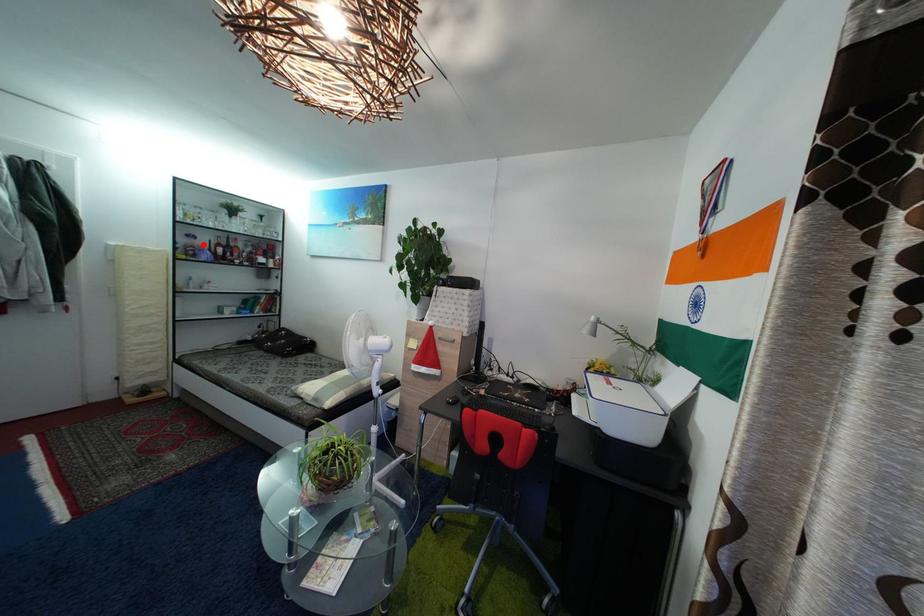
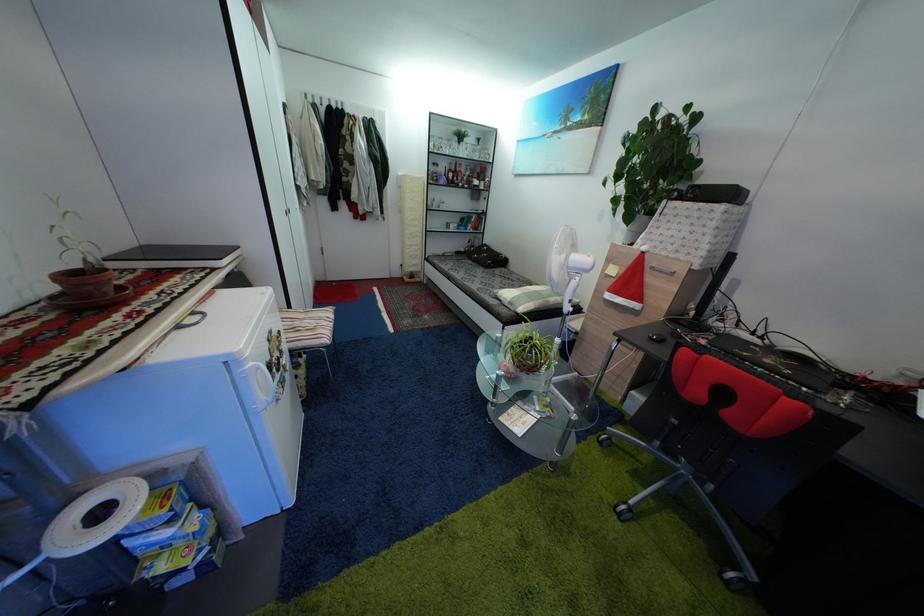
Question: I am providing you with two images of the same scene from different viewpoints. A red point is shown in image1. For the corresponding object point in image2, is it positioned nearer or farther from the camera?

Choices:
 (A) Nearer
 (B) Farther

Answer: (A)